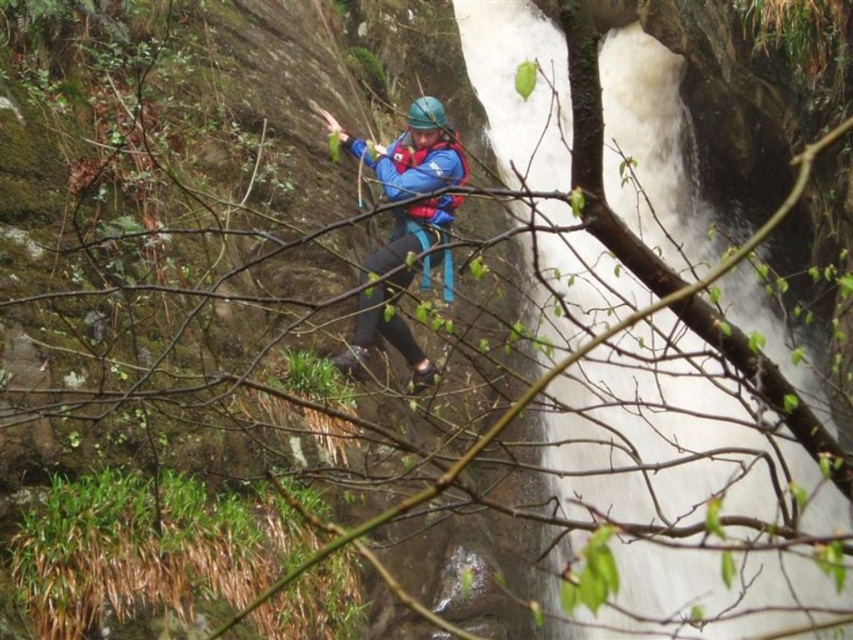
Can you confirm if white frothy water at center is positioned to the left of blue matte life vest at center?

In fact, white frothy water at center is to the right of blue matte life vest at center.

Between point (641, 588) and point (451, 209), which one is positioned behind?

Point (641, 588)

Find the location of a particular element. This screenshot has width=853, height=640. white frothy water at center is located at coordinates (654, 429).

Where is `white frothy water at center`? This screenshot has height=640, width=853. white frothy water at center is located at coordinates (654, 429).